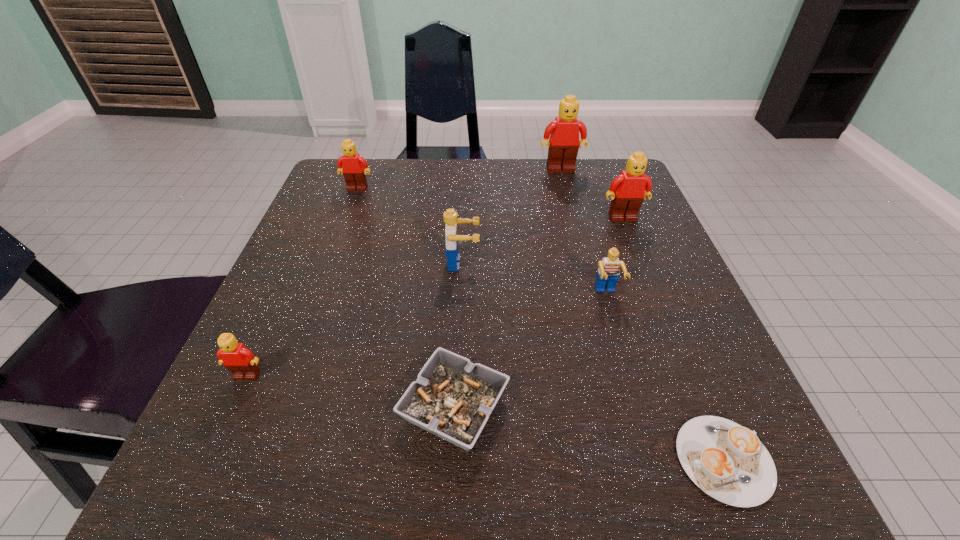
Locate an element on the screen. The image size is (960, 540). vacant area that satisfies the following two spatial constraints: 1. on the face of the smallest brown Lego; 2. on the right side of the ashtray is located at coordinates (232, 407).

Locate an element on the screen. This screenshot has width=960, height=540. vacant area in the image that satisfies the following two spatial constraints: 1. on the face of the gray ashtray; 2. on the left side of the nearest brown Lego is located at coordinates (232, 407).

Where is `vacant position in the image that satisfies the following two spatial constraints: 1. on the face of the cappuccino; 2. on the right side of the farthest object`? vacant position in the image that satisfies the following two spatial constraints: 1. on the face of the cappuccino; 2. on the right side of the farthest object is located at coordinates (637, 460).